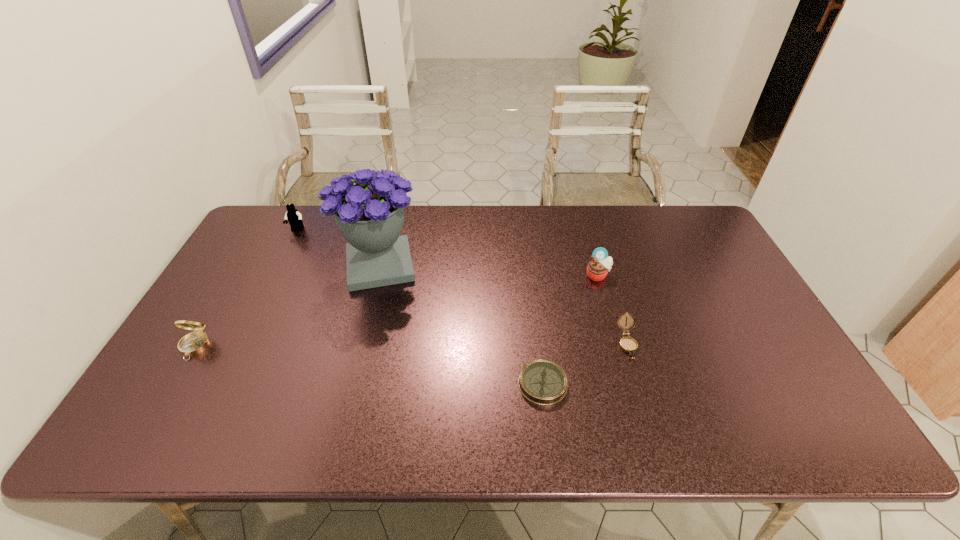
Image resolution: width=960 pixels, height=540 pixels. In order to click on vacant space in between the shortest compass and the muffin in this screenshot , I will do `click(570, 330)`.

Locate an element on the screen. This screenshot has width=960, height=540. free spot between the muffin and the rightmost compass is located at coordinates (612, 309).

This screenshot has height=540, width=960. What are the coordinates of `vacant space in between the third object from left to right and the second compass from left to right` in the screenshot? It's located at (461, 325).

Identify the location of unoccupied area between the fifth tallest object and the leftmost object. (411, 345).

Image resolution: width=960 pixels, height=540 pixels. What are the coordinates of `vacant space in between the tallest object and the second object from left to right` in the screenshot? It's located at (x=338, y=248).

The width and height of the screenshot is (960, 540). Identify the location of free spot between the second shortest object and the shortest object. (585, 364).

Identify the location of vacant region between the fifth tallest object and the leftmost object. The height and width of the screenshot is (540, 960). (411, 345).

You are a GUI agent. You are given a task and a screenshot of the screen. Output one action in this format:
    pyautogui.click(x=<x>, y=<y>)
    Task: Click on the object that is the second nearest to the third object from left to right
    This screenshot has height=540, width=960.
    Given the screenshot: What is the action you would take?
    194,343

Locate which object ranks fifth in proximity to the muffin. Please provide its 2D coordinates. Your answer should be formatted as a tuple, i.e. [(x, y)], where the tuple contains the x and y coordinates of a point satisfying the conditions above.

[(194, 343)]

At what (x,y) coordinates should I click in order to perform the action: click on compass that is the second closest to the rightmost compass. Please return your answer as a coordinate pair (x, y). Image resolution: width=960 pixels, height=540 pixels. Looking at the image, I should click on tap(194, 343).